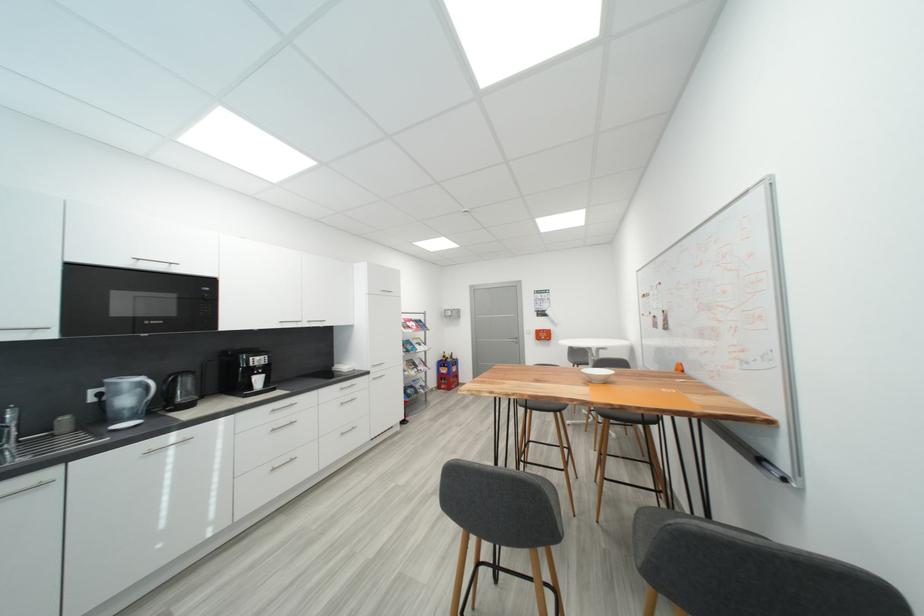
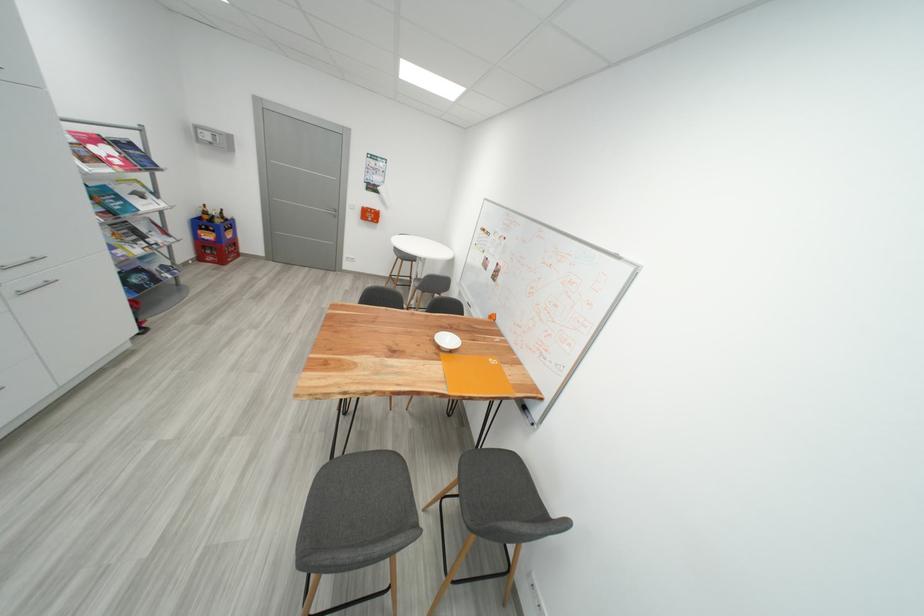
Locate, in the second image, the point that corresponds to (455,358) in the first image.

(220, 214)